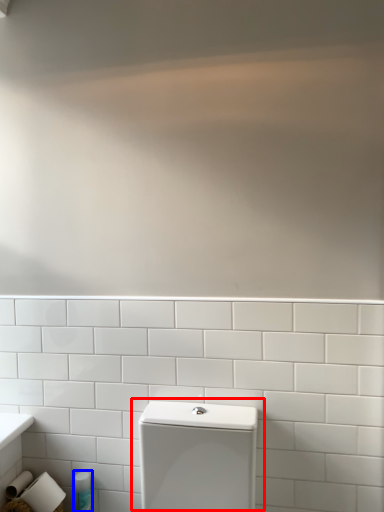
Question: Which of the following is the farthest to the observer, toilet (highlighted by a red box) or toiletry (highlighted by a blue box)?

Choices:
 (A) toilet
 (B) toiletry

Answer: (B)